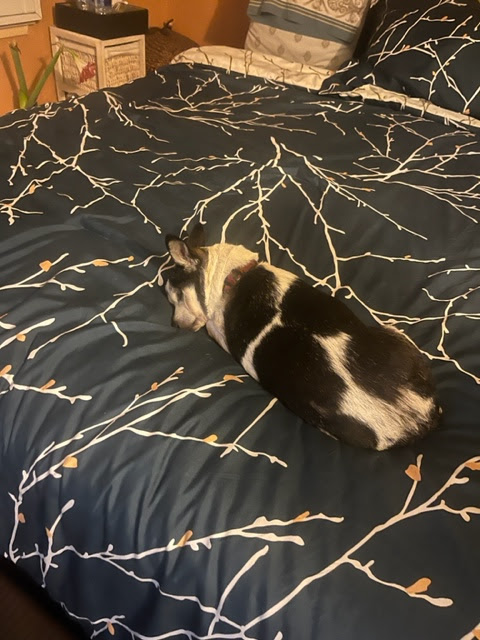
Find the location of `pillow`. pillow is located at coordinates (435, 48), (311, 35).